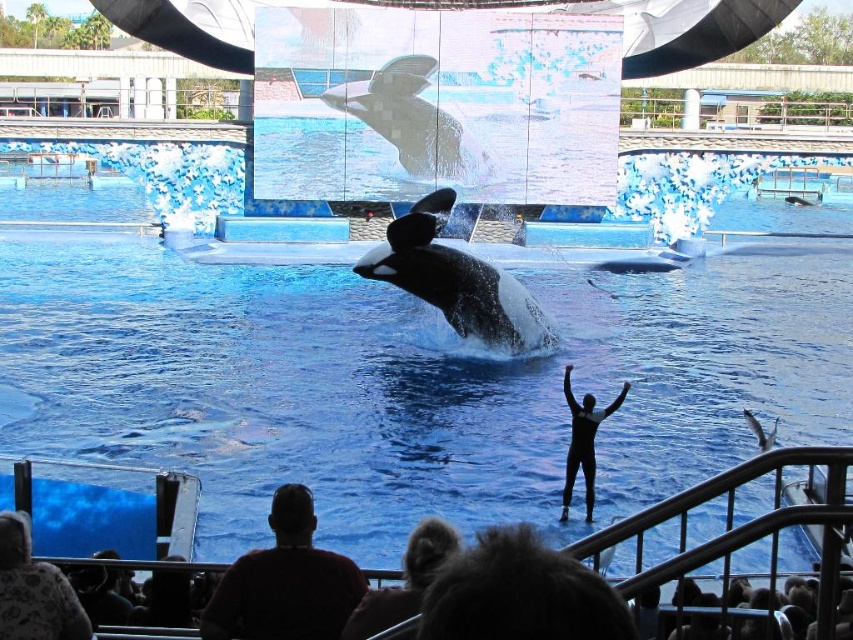
Question: Can you confirm if black smooth whale at center is positioned below black smooth dolphin at center?

Choices:
 (A) no
 (B) yes

Answer: (A)

Question: Which is farther from the black smooth dolphin at center?

Choices:
 (A) blue glossy water at center
 (B) dark red sweater at lower center
 (C) black wetsuit at center

Answer: (B)

Question: Among these points, which one is farthest from the camera?

Choices:
 (A) (543, 438)
 (B) (434, 572)
 (C) (270, 548)

Answer: (A)

Question: Based on their relative distances, which object is farther from the fluffy white sweater at lower left?

Choices:
 (A) black smooth whale at center
 (B) black smooth whale at upper center
 (C) black smooth dolphin at center
 (D) dark red sweater at lower center

Answer: (C)

Question: Can you confirm if dark red sweater at lower center is positioned to the right of fluffy white sweater at lower left?

Choices:
 (A) no
 (B) yes

Answer: (B)

Question: Can you confirm if black smooth whale at center is positioned below black smooth whale at upper center?

Choices:
 (A) no
 (B) yes

Answer: (B)